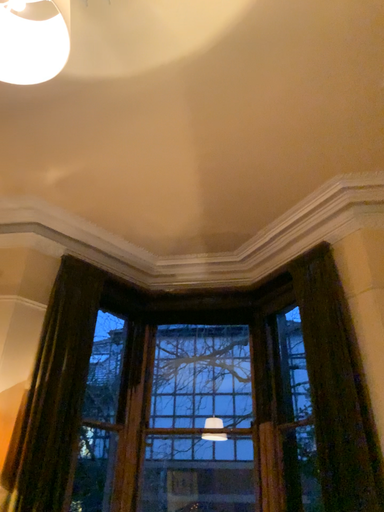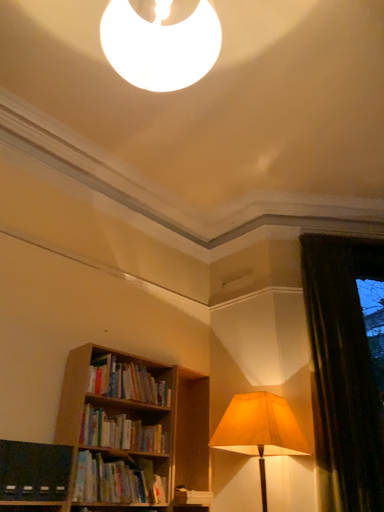
Question: Which way did the camera rotate in the video?

Choices:
 (A) rotated left
 (B) rotated right

Answer: (A)